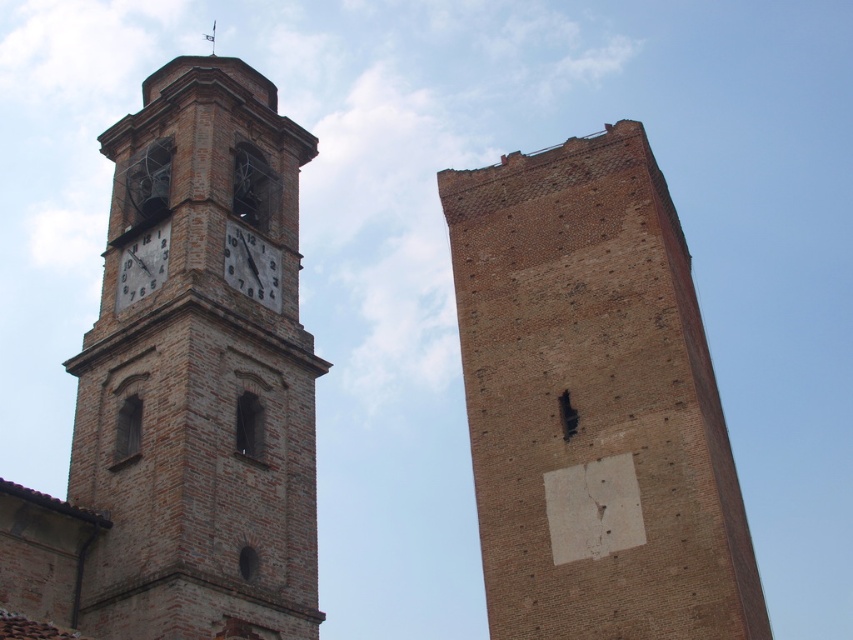
You are standing in a park and see the brown brick tower at center and the brown brick clock tower at left. Which structure is positioned lower in the image?

The brown brick tower at center is positioned lower than the brown brick clock tower at left according to the description.

Please provide the 2D coordinates of the matte brick clock at center in the image. The coordinates should be in the format of a tuple with two decimal numbers separated by a comma, enclosed in parentheses. For example, if the coordinates are 0.3 and 0.7, the answer would be written as follows. Answer with the exact coordinates provided in the description. Answer with the exact coordinates provided in the Objects Description. Answer with the exact coordinates provided in the Objects Description. Answer with

The coordinates of the matte brick clock at center are at point (252, 266), so the 2D coordinates are written as the tuple with two decimal numbers separated by a comma, enclosed in parentheses. The exact coordinates provided in the Objects Description are Answer with the exact coordinates provided in the Objects Description. The exact coordinates provided in the Objects Description are Answer with the exact coordinates provided in the Objects Description. The exact coordinates provided in the Objects are